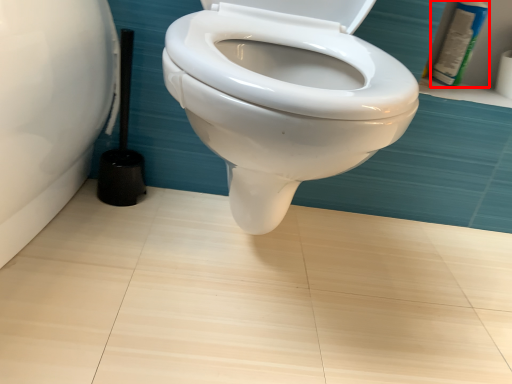
Question: Observing the image, what is the correct spatial positioning of toiletry (annotated by the red box) in reference to brush?

Choices:
 (A) left
 (B) right

Answer: (B)